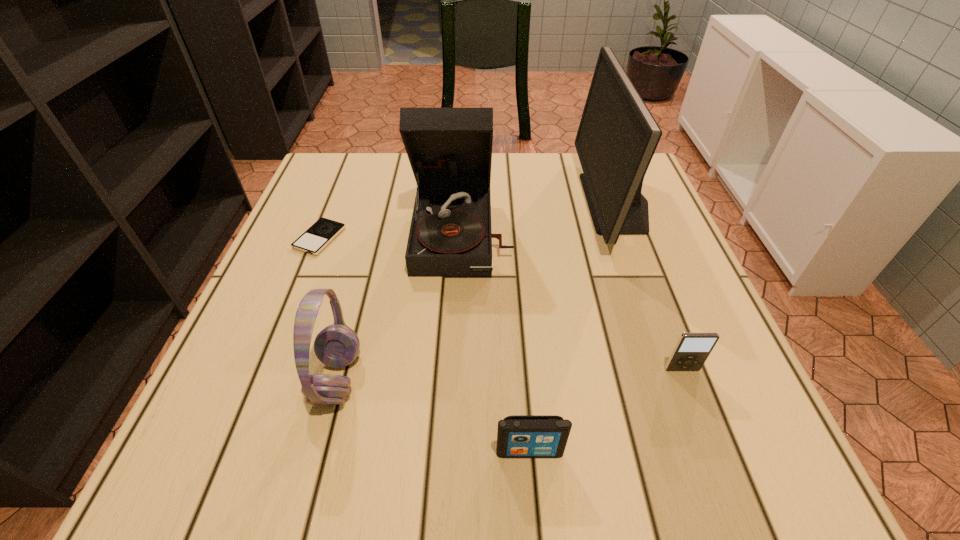
Where is `iPod present at the left edge`? iPod present at the left edge is located at coordinates (323, 231).

Image resolution: width=960 pixels, height=540 pixels. What are the coordinates of `computer monitor at the right edge` in the screenshot? It's located at (617, 137).

Identify the location of iPod present at the right edge. (692, 349).

Where is `object present at the far right corner`? object present at the far right corner is located at coordinates (617, 137).

Identify the location of vacant space at the far edge. (571, 191).

Where is `vacant space at the near edge of the desktop`? vacant space at the near edge of the desktop is located at coordinates (390, 476).

The image size is (960, 540). I want to click on vacant space at the left edge of the desktop, so click(285, 336).

At what (x,y) coordinates should I click in order to perform the action: click on free space at the right edge of the desktop. Please return your answer as a coordinate pair (x, y). The image size is (960, 540). Looking at the image, I should click on (679, 323).

Locate an element on the screen. The image size is (960, 540). vacant space at the far left corner is located at coordinates (335, 186).

In order to click on free space at the near left corner of the desktop in this screenshot , I will do `click(276, 439)`.